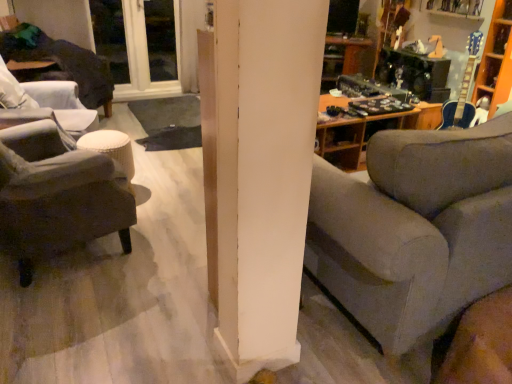
Question: Does dark gray fabric ottoman at left, the 1th chair positioned from the bottom, appear on the left side of white plastic window at upper left?

Choices:
 (A) no
 (B) yes

Answer: (A)

Question: Can you confirm if dark gray fabric ottoman at left, arranged as the first chair when viewed from the front, is bigger than white plastic window at upper left?

Choices:
 (A) yes
 (B) no

Answer: (A)

Question: From the image's perspective, is dark gray fabric ottoman at left, the 2th chair viewed from the back, beneath white plastic window at upper left?

Choices:
 (A) no
 (B) yes

Answer: (B)

Question: Is dark gray fabric ottoman at left, arranged as the first chair when viewed from the front, in front of white plastic window at upper left?

Choices:
 (A) no
 (B) yes

Answer: (B)

Question: Is dark gray fabric ottoman at left, arranged as the first chair when viewed from the front, at the right side of white plastic window at upper left?

Choices:
 (A) yes
 (B) no

Answer: (A)

Question: Considering the positions of gray fabric couch at center and white plastic window at upper left in the image, is gray fabric couch at center wider or thinner than white plastic window at upper left?

Choices:
 (A) thin
 (B) wide

Answer: (B)

Question: From the image's perspective, relative to white plastic window at upper left, is gray fabric couch at center above or below?

Choices:
 (A) below
 (B) above

Answer: (A)

Question: Considering their positions, is gray fabric couch at center located in front of or behind white plastic window at upper left?

Choices:
 (A) behind
 (B) front

Answer: (B)

Question: Choose the correct answer: Is gray fabric couch at center inside white plastic window at upper left or outside it?

Choices:
 (A) outside
 (B) inside

Answer: (A)

Question: Do you think dark gray fabric ottoman at left, the 2th chair positioned from the top, is within white plastic window at upper left, or outside of it?

Choices:
 (A) inside
 (B) outside

Answer: (B)

Question: In terms of height, does dark gray fabric ottoman at left, the 2th chair positioned from the top, look taller or shorter compared to white plastic window at upper left?

Choices:
 (A) short
 (B) tall

Answer: (A)

Question: Is dark gray fabric ottoman at left, the 2th chair viewed from the back, to the left or to the right of white plastic window at upper left in the image?

Choices:
 (A) left
 (B) right

Answer: (B)

Question: Based on their sizes in the image, would you say dark gray fabric ottoman at left, the 2th chair viewed from the back, is bigger or smaller than white plastic window at upper left?

Choices:
 (A) small
 (B) big

Answer: (B)

Question: In terms of height, does dark fabric chair at left, the 1th chair viewed from the top, look taller or shorter compared to dark gray fabric ottoman at left, the 2th chair positioned from the top?

Choices:
 (A) tall
 (B) short

Answer: (B)

Question: Considering the positions of dark fabric chair at left, acting as the second chair starting from the front, and dark gray fabric ottoman at left, the 1th chair positioned from the bottom, in the image, is dark fabric chair at left, acting as the second chair starting from the front, wider or thinner than dark gray fabric ottoman at left, the 1th chair positioned from the bottom,?

Choices:
 (A) thin
 (B) wide

Answer: (B)